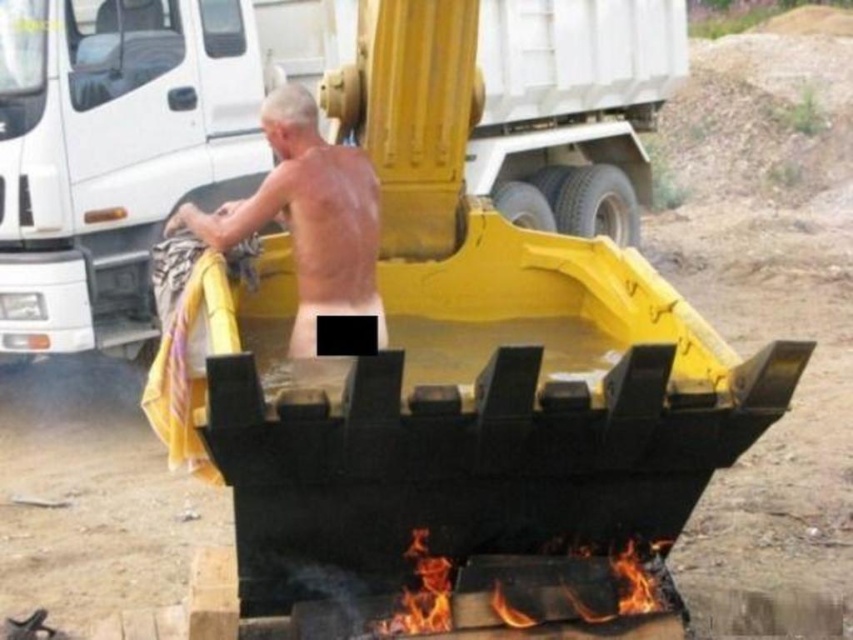
Question: Considering the relative positions of metallic yellow excavator bucket at center and shiny metallic man at center in the image provided, where is metallic yellow excavator bucket at center located with respect to shiny metallic man at center?

Choices:
 (A) below
 (B) above

Answer: (A)

Question: Which of these objects is positioned farthest from the metallic yellow excavator bucket at center?

Choices:
 (A) shiny metallic man at center
 (B) flaming wood at lower center

Answer: (B)

Question: From the image, what is the correct spatial relationship of metallic yellow excavator bucket at center in relation to flaming wood at lower center?

Choices:
 (A) below
 (B) above

Answer: (B)

Question: Is metallic yellow excavator bucket at center further to camera compared to shiny metallic man at center?

Choices:
 (A) yes
 (B) no

Answer: (A)

Question: Which object is the farthest from the flaming wood at lower center?

Choices:
 (A) shiny metallic man at center
 (B) metallic yellow excavator bucket at center

Answer: (B)

Question: Which point is farther to the camera?

Choices:
 (A) (144, 205)
 (B) (416, 554)

Answer: (A)